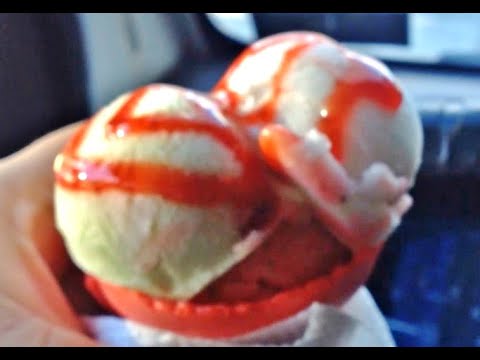
Where is `napkin`? napkin is located at coordinates (333, 316).